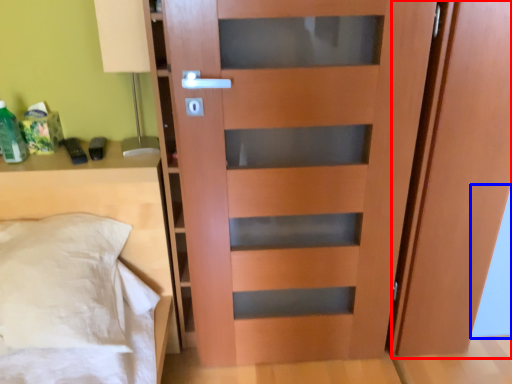
Question: Which point is closer to the camera, screen door (highlighted by a red box) or glass door (highlighted by a blue box)?

Choices:
 (A) screen door
 (B) glass door

Answer: (A)